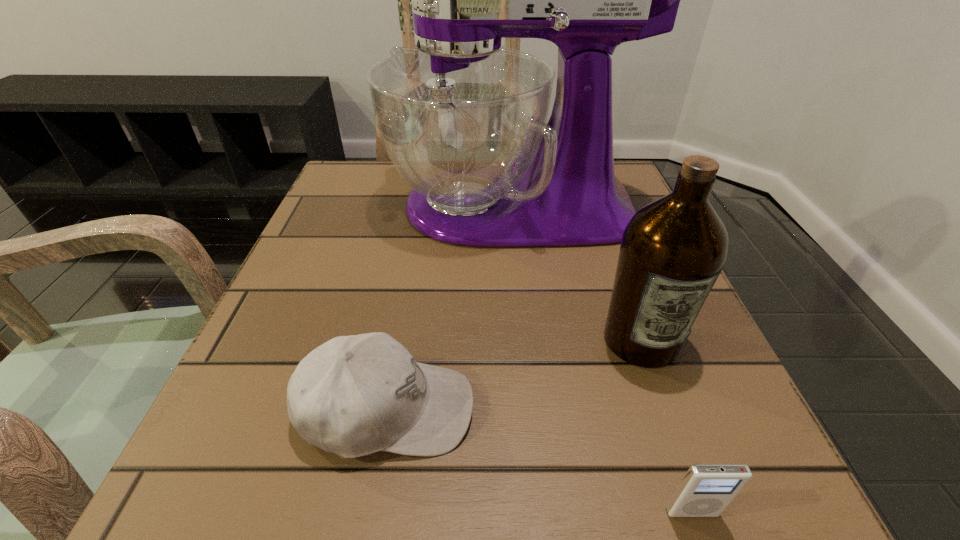
Identify the location of vacant area that lies between the shortest object and the tallest object. The width and height of the screenshot is (960, 540). (601, 359).

This screenshot has height=540, width=960. I want to click on free area in between the baseball cap and the olive oil, so click(514, 375).

The image size is (960, 540). What are the coordinates of `vacant space that's between the baseball cap and the olive oil` in the screenshot? It's located at (514, 375).

Image resolution: width=960 pixels, height=540 pixels. In order to click on free area in between the baseball cap and the olive oil in this screenshot , I will do `click(514, 375)`.

The image size is (960, 540). Find the location of `vacant space in between the baseball cap and the shortest object`. vacant space in between the baseball cap and the shortest object is located at coordinates (540, 461).

Where is `vacant area between the iPod and the baseball cap`? This screenshot has height=540, width=960. vacant area between the iPod and the baseball cap is located at coordinates (540, 461).

Locate an element on the screen. Image resolution: width=960 pixels, height=540 pixels. free space between the baseball cap and the farthest object is located at coordinates (449, 308).

Select which object is the second closest to the baseball cap. Please provide its 2D coordinates. Your answer should be formatted as a tuple, i.e. [(x, y)], where the tuple contains the x and y coordinates of a point satisfying the conditions above.

[(706, 490)]

Find the location of a particular element. The width and height of the screenshot is (960, 540). object that stands as the second closest to the nearest object is located at coordinates (355, 395).

Find the location of `vacant region that satisfies the following two spatial constraints: 1. on the label of the olive oil; 2. on the front-facing side of the baseball cap`. vacant region that satisfies the following two spatial constraints: 1. on the label of the olive oil; 2. on the front-facing side of the baseball cap is located at coordinates (665, 410).